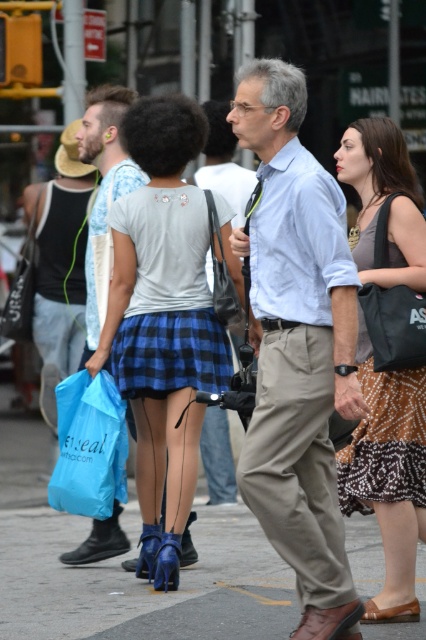
Question: Estimate the real-world distances between objects in this image. Which object is farther from the khaki pants at center?

Choices:
 (A) blue plastic bag at lower left
 (B) matte blue skirt at center
 (C) blue plaid skirt at center

Answer: (C)

Question: Is brown dotted skirt at center above blue plastic bag at lower left?

Choices:
 (A) no
 (B) yes

Answer: (B)

Question: Is matte blue skirt at center smaller than brown dotted skirt at center?

Choices:
 (A) no
 (B) yes

Answer: (A)

Question: Estimate the real-world distances between objects in this image. Which object is closer to the khaki pants at center?

Choices:
 (A) blue plaid skirt at center
 (B) blue patent leather high heels at center

Answer: (A)

Question: Among these points, which one is nearest to the camera?

Choices:
 (A) (374, 221)
 (B) (293, 92)
 (C) (83, 426)
 (D) (0, 541)

Answer: (B)

Question: Does khaki pants at center have a smaller size compared to blue plaid skirt at center?

Choices:
 (A) no
 (B) yes

Answer: (A)